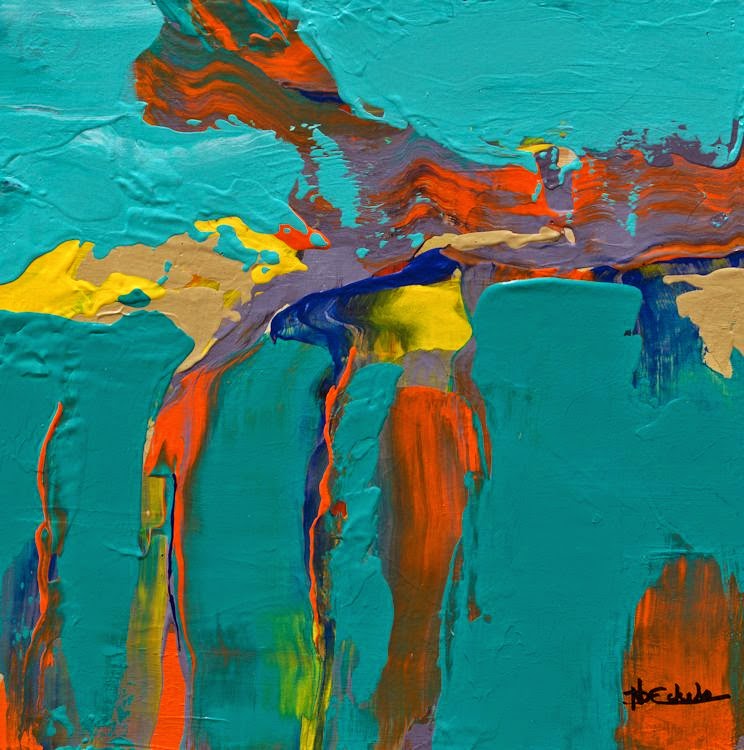
The image size is (744, 750). Find the location of `smooth blue paint`. smooth blue paint is located at coordinates [513, 330].